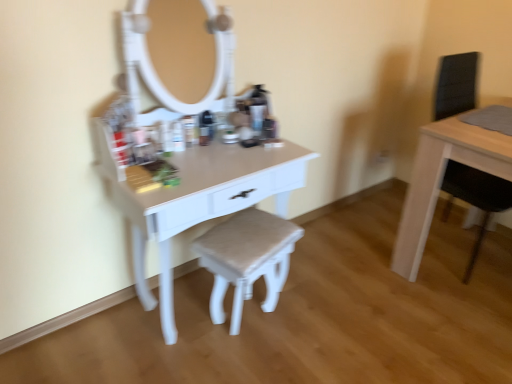
The image size is (512, 384). I want to click on vacant space positioned to the left of light wood table at right, acting as the first table starting from the right, so click(367, 246).